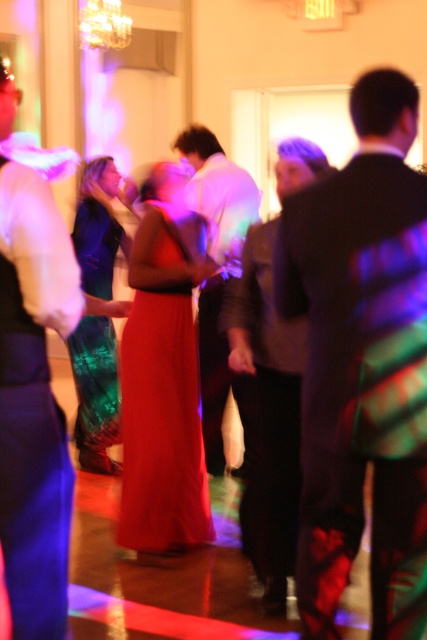
Question: Which is farther from the shiny green dress at center?

Choices:
 (A) white shirt at center
 (B) matte white shirt at left
 (C) matte red dress at center

Answer: (B)

Question: Which object is positioned farthest from the matte red dress at center?

Choices:
 (A) shiny black suit at center
 (B) white shirt at center
 (C) matte white shirt at left

Answer: (C)

Question: Which object appears closest to the camera in this image?

Choices:
 (A) shiny green dress at center
 (B) matte white shirt at left
 (C) shiny black suit at center
 (D) white shirt at center

Answer: (B)

Question: In this image, where is matte white shirt at left located relative to shiny green dress at center?

Choices:
 (A) below
 (B) above

Answer: (A)

Question: Does matte red dress at center appear over white shirt at center?

Choices:
 (A) yes
 (B) no

Answer: (B)

Question: Can you confirm if matte red dress at center is positioned below dark gray sweater at center?

Choices:
 (A) no
 (B) yes

Answer: (B)